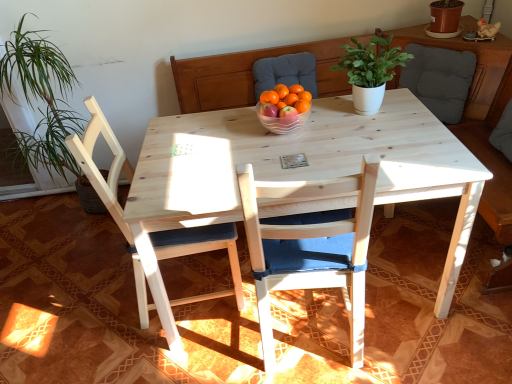
Question: Does clear plastic bowl at center have a lesser height compared to orange matte at center, which is the 2th tangerine from right to left?

Choices:
 (A) yes
 (B) no

Answer: (A)

Question: From a real-world perspective, is clear plastic bowl at center located beneath orange matte at center, which is the 2th tangerine from right to left?

Choices:
 (A) yes
 (B) no

Answer: (A)

Question: Would you say clear plastic bowl at center is a long distance from orange matte at center, which is the first tangerine in left-to-right order?

Choices:
 (A) no
 (B) yes

Answer: (A)

Question: Is clear plastic bowl at center aimed at orange matte at center, which is the first tangerine in left-to-right order?

Choices:
 (A) yes
 (B) no

Answer: (B)

Question: Is clear plastic bowl at center positioned before orange matte at center, which is the first tangerine in left-to-right order?

Choices:
 (A) no
 (B) yes

Answer: (B)

Question: From the image's perspective, is natural wood chair at left, positioned as the first chair in left-to-right order, located above or below orange matte at center, which is the first tangerine in left-to-right order?

Choices:
 (A) above
 (B) below

Answer: (B)

Question: Visually, is natural wood chair at left, acting as the second chair starting from the right, positioned to the left or to the right of orange matte at center, which is the 2th tangerine from right to left?

Choices:
 (A) left
 (B) right

Answer: (A)

Question: In terms of width, does natural wood chair at left, acting as the second chair starting from the right, look wider or thinner when compared to orange matte at center, which is the 2th tangerine from right to left?

Choices:
 (A) wide
 (B) thin

Answer: (A)

Question: Considering the positions of natural wood chair at left, positioned as the first chair in left-to-right order, and orange matte at center, which is the first tangerine in left-to-right order, in the image, is natural wood chair at left, positioned as the first chair in left-to-right order, bigger or smaller than orange matte at center, which is the first tangerine in left-to-right order,?

Choices:
 (A) big
 (B) small

Answer: (A)

Question: Visually, is orange matte at center positioned to the left or to the right of white matte plant pot at center?

Choices:
 (A) right
 (B) left

Answer: (B)

Question: Considering the positions of orange matte at center and white matte plant pot at center in the image, is orange matte at center bigger or smaller than white matte plant pot at center?

Choices:
 (A) small
 (B) big

Answer: (A)

Question: Considering the positions of orange matte at center and white matte plant pot at center in the image, is orange matte at center taller or shorter than white matte plant pot at center?

Choices:
 (A) short
 (B) tall

Answer: (A)

Question: Is orange matte at center spatially inside white matte plant pot at center, or outside of it?

Choices:
 (A) outside
 (B) inside

Answer: (A)

Question: Choose the correct answer: Is white matte plant pot at center inside orange matte at center or outside it?

Choices:
 (A) outside
 (B) inside

Answer: (A)

Question: Considering their positions, is white matte plant pot at center located in front of or behind orange matte at center?

Choices:
 (A) front
 (B) behind

Answer: (A)